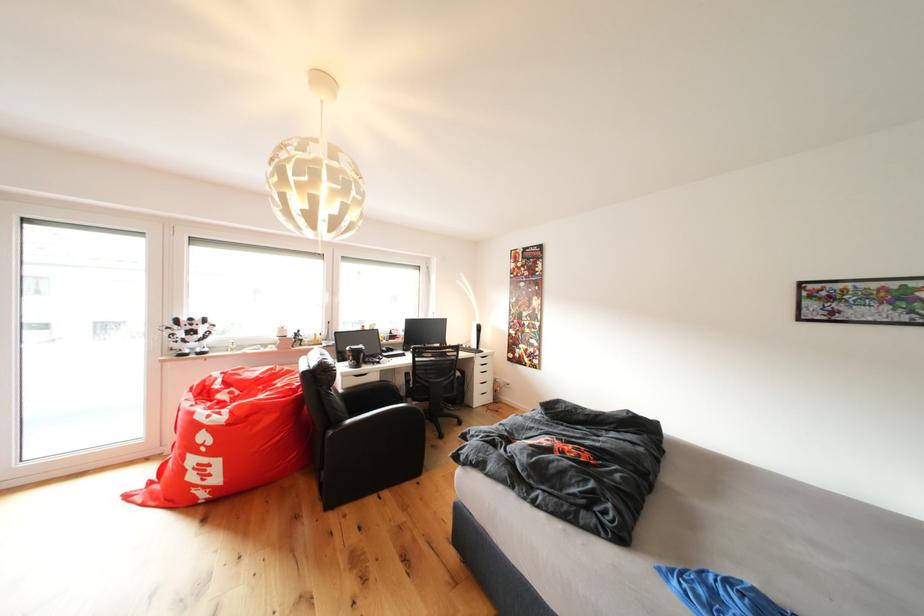
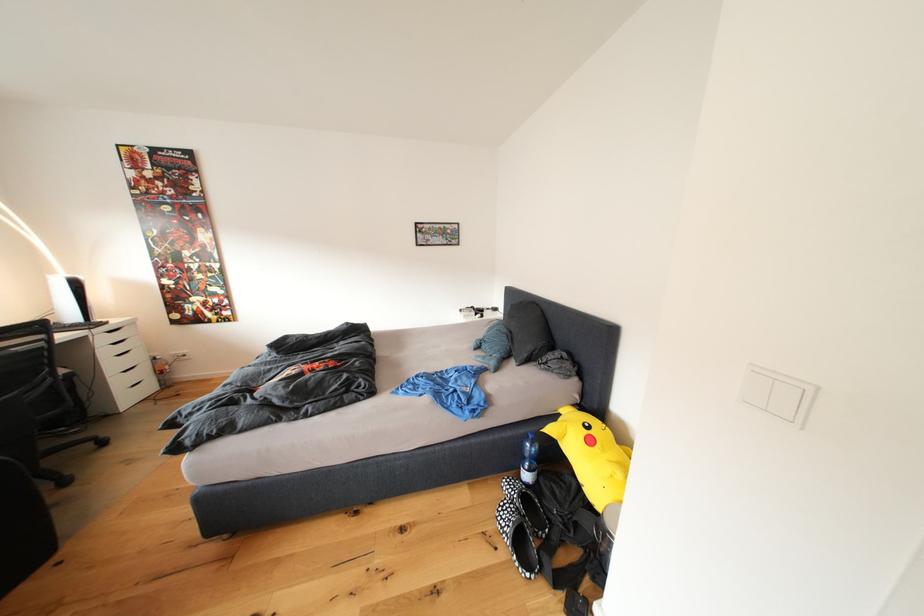
Find the pixel in the second image that matches the point at 494,357 in the first image.

(125, 326)